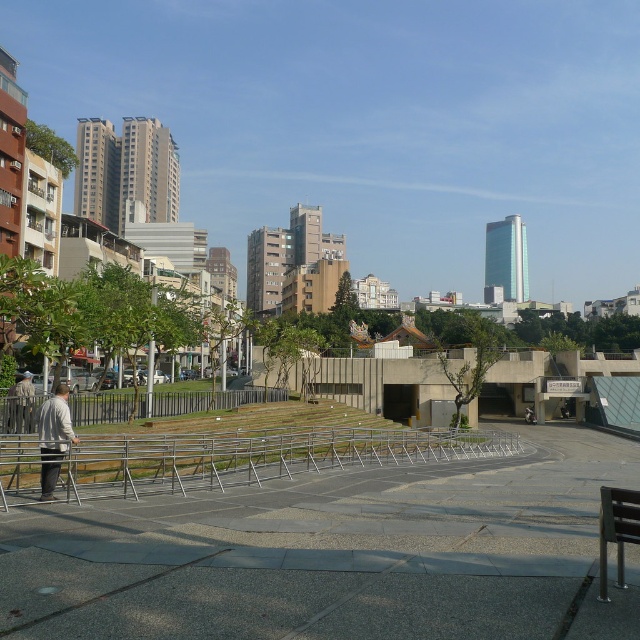
You are a delivery person standing at the entrance of the park. You need to deliver a package to the light gray sweater at left and the light brown leather jacket at lower left. Which one is farther from your current position?

The light gray sweater at left is farther from your current position because it is 34.27 feet away from the light brown leather jacket at lower left, which is closer to the entrance.

You are a park visitor who wants to sit on the black metal bench at lower right. However, there is a light brown leather jacket at lower left in the way. Can you sit on the bench without moving the jacket?

The black metal bench at lower right is above the light brown leather jacket at lower left, meaning the bench is elevated and not directly obstructed by the jacket. Therefore, you can sit on the bench without moving the jacket.

You are a visitor in the park and want to sit on the black metal bench at lower right. Which direction should you walk from the silver metallic rail at center to reach it?

You should walk to the right from the silver metallic rail at center to reach the black metal bench at lower right because the silver metallic rail at center is to the left of the black metal bench at lower right.